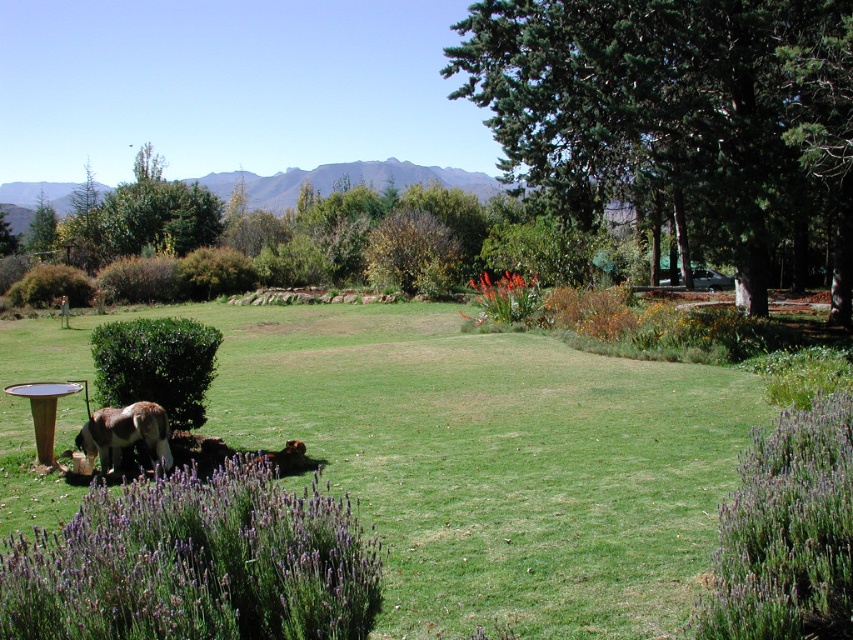
Question: Observing the image, what is the correct spatial positioning of brown fuzzy elephant at lower left in reference to brown furry dog at lower left?

Choices:
 (A) above
 (B) below

Answer: (A)

Question: Which point is farther to the camera?

Choices:
 (A) (97, 451)
 (B) (306, 460)
 (C) (474, 604)
 (D) (757, 474)

Answer: (B)

Question: Among these points, which one is nearest to the camera?

Choices:
 (A) (784, 560)
 (B) (466, 416)
 (C) (370, 545)

Answer: (A)

Question: Which of the following is the closest to the observer?

Choices:
 (A) brown fuzzy elephant at lower left
 (B) green leafy tree at center right
 (C) green grass at center

Answer: (C)

Question: Can you confirm if green grass at center is positioned below purple soft lavender at lower left?

Choices:
 (A) yes
 (B) no

Answer: (B)

Question: Does green grass at center come in front of brown furry dog at lower left?

Choices:
 (A) yes
 (B) no

Answer: (A)